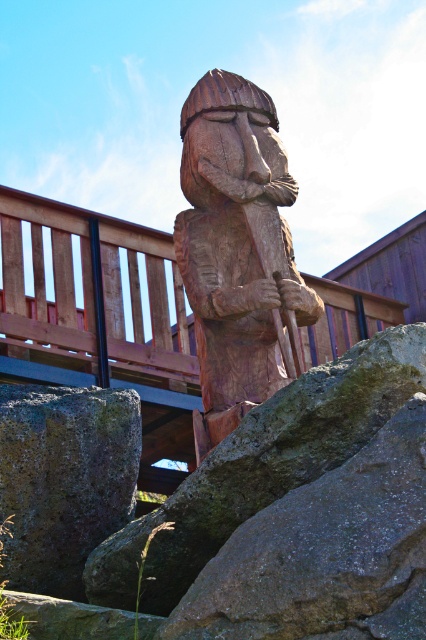
Between rough textured rock at center and gray rough stone at lower left, which one appears on the left side from the viewer's perspective?

Positioned to the left is gray rough stone at lower left.

Which is behind, point (345, 460) or point (39, 412)?

Positioned behind is point (39, 412).

Describe the element at coordinates (261, 467) in the screenshot. The width and height of the screenshot is (426, 640). I see `rough textured rock at center` at that location.

Image resolution: width=426 pixels, height=640 pixels. In order to click on rough textured rock at center in this screenshot , I will do (261, 467).

Does point (259, 388) come behind point (284, 438)?

That is True.

Locate an element on the screen. Image resolution: width=426 pixels, height=640 pixels. wooden statue at center is located at coordinates (238, 248).

Is wooden statue at center below gray rough stone at lower left?

Incorrect, wooden statue at center is not positioned below gray rough stone at lower left.

Does wooden statue at center have a greater width compared to gray rough stone at lower left?

Yes.

Does point (244, 356) come farther from viewer compared to point (19, 573)?

That is True.

Find the location of `wooden statue at center`. wooden statue at center is located at coordinates (238, 248).